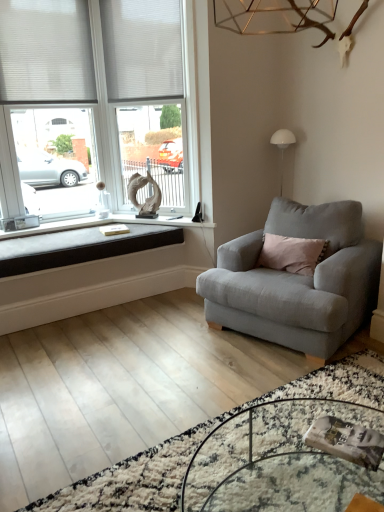
Question: Can you see white fabric blind at upper left, which is the 2th blind from left to right, touching white plastic window frame at upper left?

Choices:
 (A) yes
 (B) no

Answer: (B)

Question: Is white fabric blind at upper left, the first blind when ordered from right to left, smaller than white plastic window frame at upper left?

Choices:
 (A) no
 (B) yes

Answer: (B)

Question: Considering the relative sizes of white fabric blind at upper left, which is the 2th blind from left to right, and white plastic window frame at upper left in the image provided, is white fabric blind at upper left, which is the 2th blind from left to right, taller than white plastic window frame at upper left?

Choices:
 (A) yes
 (B) no

Answer: (B)

Question: Considering the relative sizes of white fabric blind at upper left, the first blind when ordered from right to left, and white plastic window frame at upper left in the image provided, is white fabric blind at upper left, the first blind when ordered from right to left, shorter than white plastic window frame at upper left?

Choices:
 (A) no
 (B) yes

Answer: (B)

Question: Is white fabric blind at upper left, the first blind when ordered from right to left, at the left side of white plastic window frame at upper left?

Choices:
 (A) yes
 (B) no

Answer: (A)

Question: From the image's perspective, is white plastic window frame at upper left positioned above or below white matte window at upper left?

Choices:
 (A) below
 (B) above

Answer: (B)

Question: Is white plastic window frame at upper left wider or thinner than white matte window at upper left?

Choices:
 (A) thin
 (B) wide

Answer: (B)

Question: From a real-world perspective, is white plastic window frame at upper left above or below white matte window at upper left?

Choices:
 (A) above
 (B) below

Answer: (A)

Question: Visually, is white plastic window frame at upper left positioned to the left or to the right of white matte window at upper left?

Choices:
 (A) left
 (B) right

Answer: (B)

Question: Considering the positions of point tap(104, 244) and point tap(89, 58), is point tap(104, 244) closer or farther from the camera than point tap(89, 58)?

Choices:
 (A) closer
 (B) farther

Answer: (A)

Question: From the image's perspective, is black fabric cushion at lower left positioned above or below white fabric blind at upper left, placed as the 1th blind when sorted from left to right?

Choices:
 (A) above
 (B) below

Answer: (B)

Question: Would you say black fabric cushion at lower left is to the left or to the right of white fabric blind at upper left, marked as the second blind in a right-to-left arrangement, in the picture?

Choices:
 (A) left
 (B) right

Answer: (B)

Question: Relative to white fabric blind at upper left, placed as the 1th blind when sorted from left to right, is black fabric cushion at lower left in front or behind?

Choices:
 (A) behind
 (B) front

Answer: (B)

Question: Considering the positions of clear glass table at lower center and white fabric blind at upper left, which is the 2th blind from left to right, in the image, is clear glass table at lower center wider or thinner than white fabric blind at upper left, which is the 2th blind from left to right,?

Choices:
 (A) wide
 (B) thin

Answer: (A)

Question: Based on their positions, is clear glass table at lower center located to the left or right of white fabric blind at upper left, which is the 2th blind from left to right?

Choices:
 (A) left
 (B) right

Answer: (B)